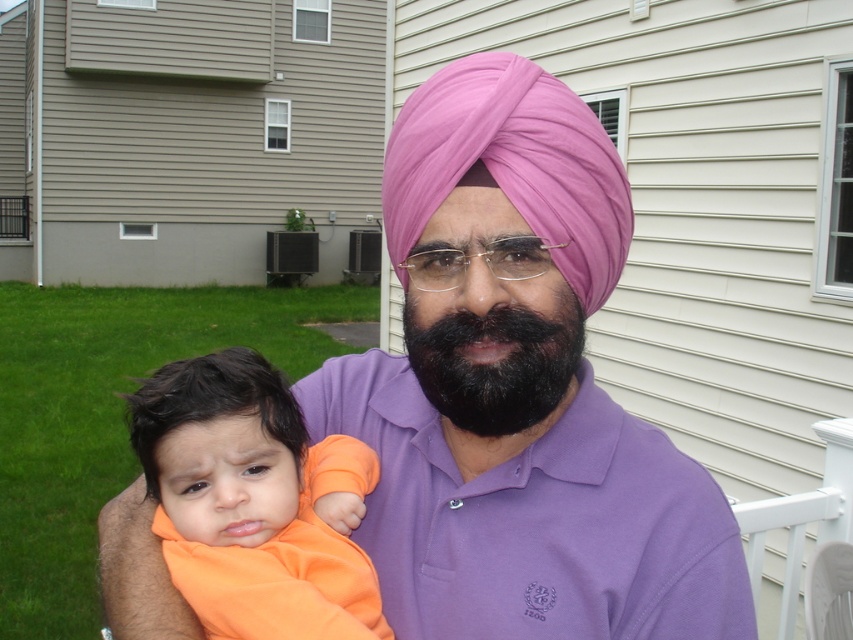
Where is the pink fabric turban at center located in the image?

The pink fabric turban at center is located at point (x=511, y=164) in the image.

You are a photographer taking a picture of the orange fleece at center and the pink fabric turban at center. Which object should you focus on first if you want to capture both in sharp focus?

The orange fleece at center is positioned under the pink fabric turban at center, so focusing on the pink fabric turban at center first would ensure both are in sharp focus since it is closer to the camera.